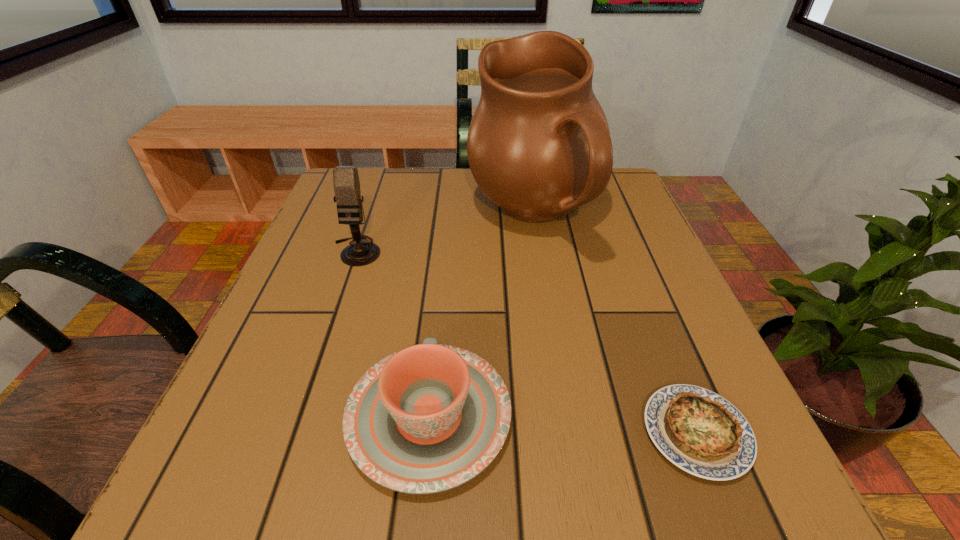
Locate an element on the screen. free spot that satisfies the following two spatial constraints: 1. at the spout of the shortest object; 2. on the right side of the cream pitcher is located at coordinates (570, 433).

Identify the location of free location that satisfies the following two spatial constraints: 1. at the spout of the tallest object; 2. on the front-facing side of the microphone. (540, 251).

Find the location of a particular element. Image resolution: width=960 pixels, height=540 pixels. vacant position in the image that satisfies the following two spatial constraints: 1. on the front-facing side of the quiche; 2. on the left side of the third shortest object is located at coordinates (294, 433).

I want to click on blank area in the image that satisfies the following two spatial constraints: 1. at the spout of the cream pitcher; 2. on the left side of the shortest object, so click(570, 433).

This screenshot has width=960, height=540. In order to click on vacant area in the image that satisfies the following two spatial constraints: 1. at the spout of the shortest object; 2. on the left side of the cream pitcher in this screenshot , I will do `click(570, 433)`.

Where is `vacant point that satisfies the following two spatial constraints: 1. at the spout of the cream pitcher; 2. on the left side of the quiche`? This screenshot has height=540, width=960. vacant point that satisfies the following two spatial constraints: 1. at the spout of the cream pitcher; 2. on the left side of the quiche is located at coordinates (570, 433).